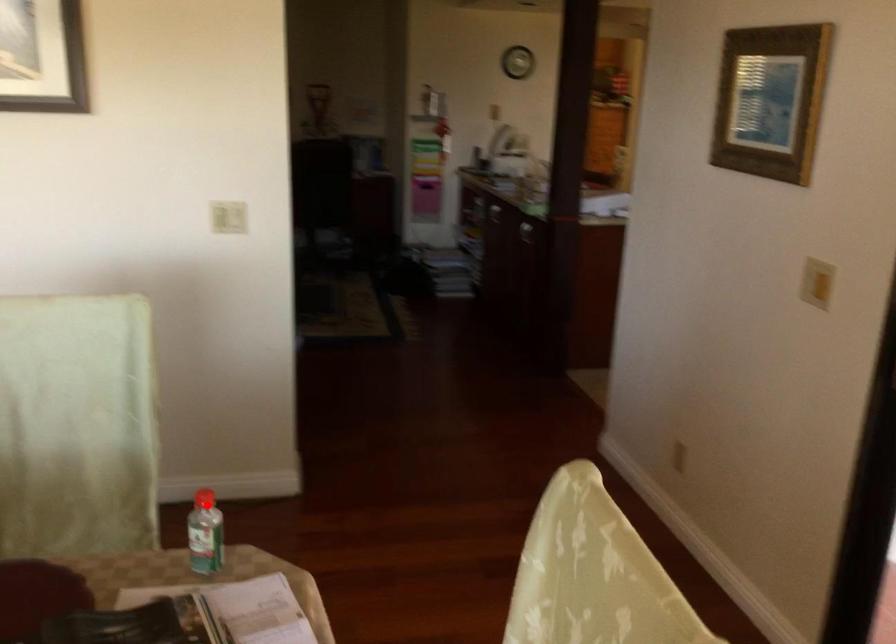
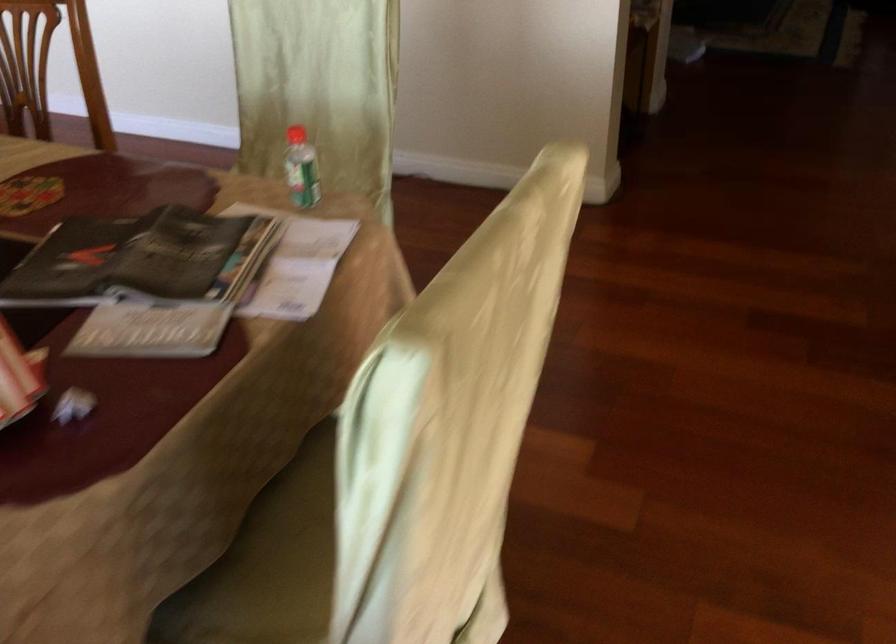
The point at the highlighted location is marked in the first image. Where is the corresponding point in the second image?

(296, 135)